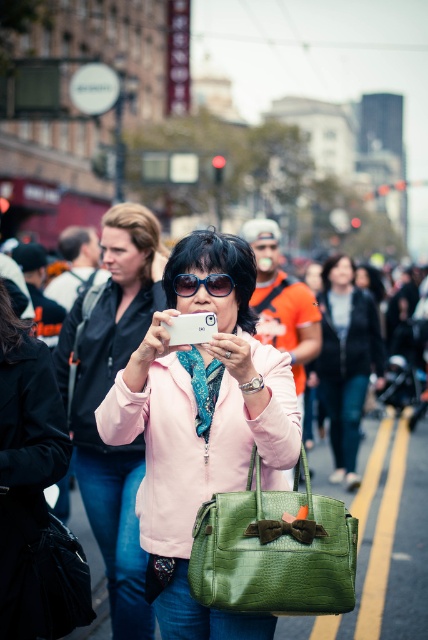
Question: Does matte pink jacket at center appear on the left side of matte green leather bag at center?

Choices:
 (A) no
 (B) yes

Answer: (B)

Question: Is green crocodile-patterned handbag at center smaller than matte green leather bag at center?

Choices:
 (A) no
 (B) yes

Answer: (B)

Question: Which object is closer to the camera taking this photo?

Choices:
 (A) black plastic goggles at center
 (B) green crocodile-patterned handbag at center

Answer: (B)

Question: Which point appears farthest from the camera in this image?

Choices:
 (A) (406, 628)
 (B) (335, 570)
 (C) (100, 483)
 (D) (192, 285)

Answer: (A)

Question: Can you confirm if matte pink jacket at center is smaller than matte green leather bag at center?

Choices:
 (A) no
 (B) yes

Answer: (B)

Question: Which point is farther to the camera?

Choices:
 (A) (240, 268)
 (B) (214, 556)

Answer: (A)